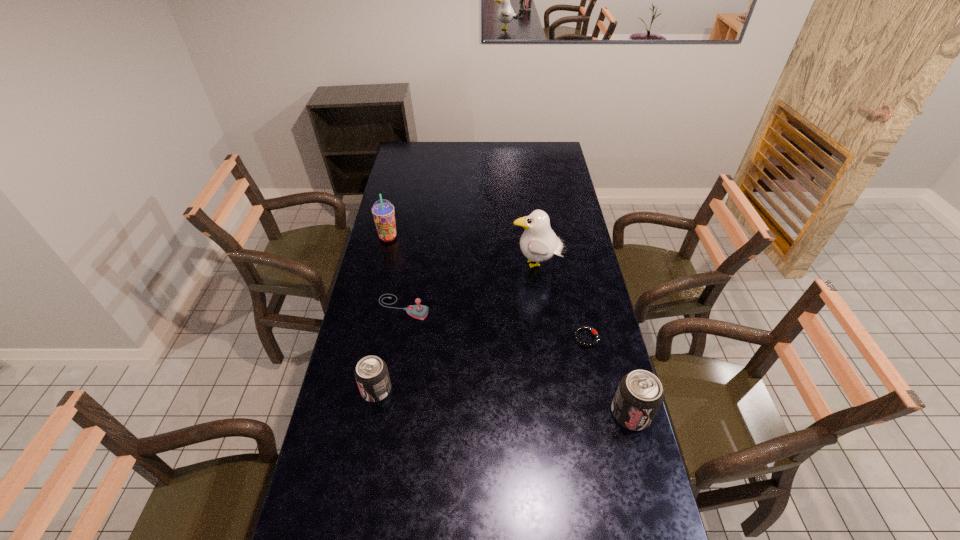
Locate an element on the screen. The width and height of the screenshot is (960, 540). the shortest object is located at coordinates (578, 329).

Find the location of a particular element. bracelet is located at coordinates (578, 329).

This screenshot has height=540, width=960. What are the coordinates of `vacant position located 0.240m on the front of the left soda can` in the screenshot? It's located at (359, 484).

Find the location of a particular element. The height and width of the screenshot is (540, 960). vacant area situated 0.120m on the front of the third tallest object is located at coordinates (646, 475).

I want to click on free space located on the right of the second tallest object, so click(x=433, y=238).

Find the location of a particular element. The width and height of the screenshot is (960, 540). vacant space located 0.270m on the beak of the tallest object is located at coordinates (444, 265).

Identify the location of blank space located 0.250m on the beak of the tallest object. The image size is (960, 540). (449, 265).

At what (x,y) coordinates should I click in order to perform the action: click on free space located 0.340m on the beak of the tallest object. Please return your answer as a coordinate pair (x, y). Looking at the image, I should click on (427, 265).

Locate an element on the screen. The height and width of the screenshot is (540, 960). free space located on the right of the fourth nearest object is located at coordinates tap(523, 307).

The width and height of the screenshot is (960, 540). I want to click on vacant space located on the left of the bracelet, so click(514, 338).